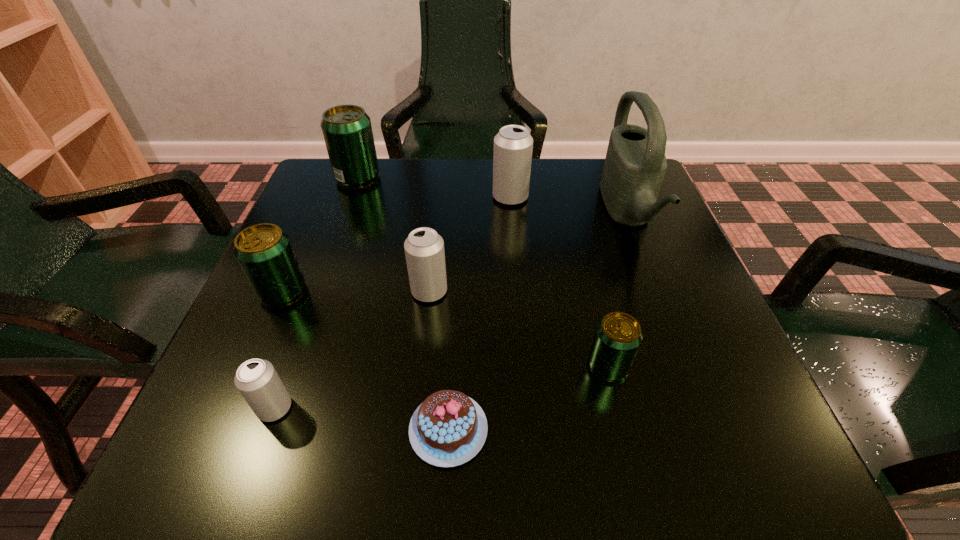
Locate an element on the screen. The image size is (960, 540). watering can is located at coordinates (635, 165).

The height and width of the screenshot is (540, 960). In order to click on the tallest object in this screenshot , I will do `click(635, 165)`.

Find the location of `the biggest green beer can`. the biggest green beer can is located at coordinates (347, 131).

The height and width of the screenshot is (540, 960). Find the location of `the second beer can from right to left`. the second beer can from right to left is located at coordinates (513, 145).

Locate an element on the screen. the biggest white beer can is located at coordinates (513, 145).

Locate an element on the screen. Image resolution: width=960 pixels, height=540 pixels. the second smallest white beer can is located at coordinates (424, 249).

I want to click on the second white beer can from right to left, so click(x=424, y=249).

Find the location of `the second biggest green beer can`. the second biggest green beer can is located at coordinates (264, 252).

This screenshot has height=540, width=960. In order to click on the rightmost beer can in this screenshot , I will do `click(618, 335)`.

Identify the location of the second nearest beer can. This screenshot has width=960, height=540. (618, 335).